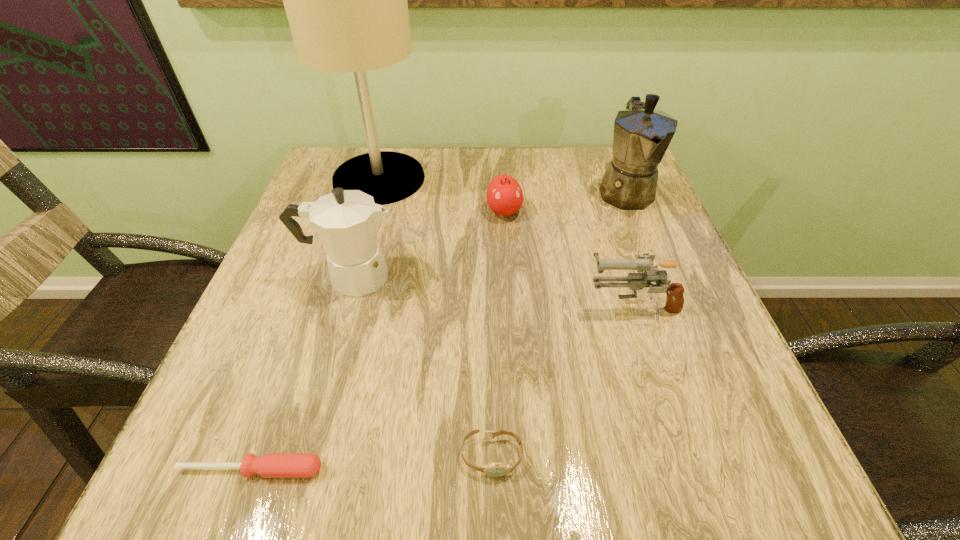
You are a GUI agent. You are given a task and a screenshot of the screen. Output one action in this format:
    pyautogui.click(x=<x>, y=<y>)
    Task: Click on the free space between the fifth shortest object and the watch
    
    Given the screenshot: What is the action you would take?
    pyautogui.click(x=421, y=366)

Where is `object that ranks as the third closest to the third shortest object`? object that ranks as the third closest to the third shortest object is located at coordinates (346, 221).

Select which object appears as the fifth closest to the tallest object. Please provide its 2D coordinates. Your answer should be formatted as a tuple, i.e. [(x, y)], where the tuple contains the x and y coordinates of a point satisfying the conditions above.

[(496, 469)]

Find the location of a particular element. The height and width of the screenshot is (540, 960). free space that satisfies the following two spatial constraints: 1. on the pouring side of the right coffeepot; 2. at the spout of the nearer coffeepot is located at coordinates (660, 276).

Locate an element on the screen. Image resolution: width=960 pixels, height=540 pixels. free space that satisfies the following two spatial constraints: 1. on the pouring side of the farther coffeepot; 2. at the barrel end of the gun is located at coordinates (670, 303).

This screenshot has height=540, width=960. In order to click on free location that satisfies the following two spatial constraints: 1. on the pouring side of the second tallest object; 2. at the spout of the fifth shortest object in this screenshot , I will do `click(660, 276)`.